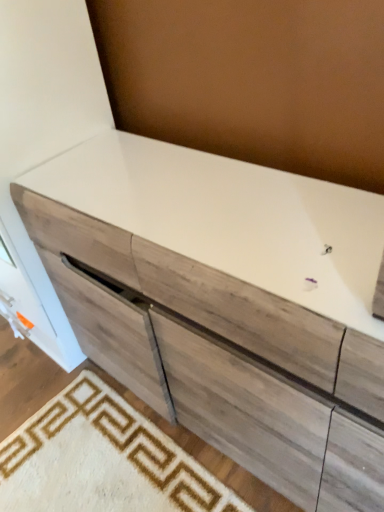
Describe the element at coordinates (226, 304) in the screenshot. The width and height of the screenshot is (384, 512). I see `wooden cabinet at center` at that location.

Where is `wooden cabinet at center`? The height and width of the screenshot is (512, 384). wooden cabinet at center is located at coordinates (226, 304).

Identify the location of wooden cabinet at center. Image resolution: width=384 pixels, height=512 pixels. (226, 304).